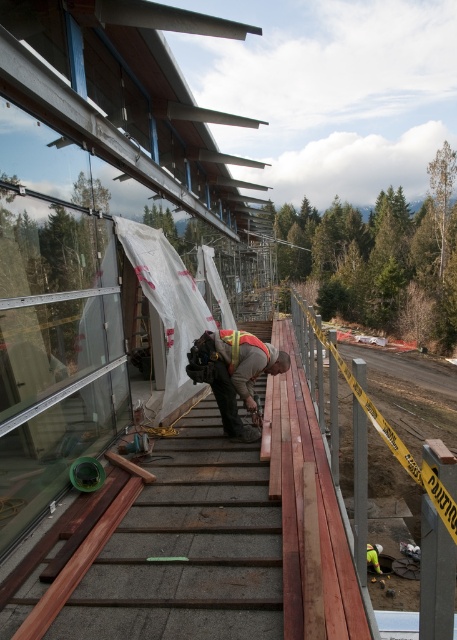
Question: Which point is closer to the camera?

Choices:
 (A) reflective orange safety vest at center
 (B) reflective safety vest at center
 (C) smooth wood stairs at center

Answer: (C)

Question: Which of the following is the closest to the observer?

Choices:
 (A) (x=259, y=340)
 (B) (x=271, y=353)

Answer: (A)

Question: Is reflective safety vest at center further to the viewer compared to reflective orange safety vest at center?

Choices:
 (A) yes
 (B) no

Answer: (B)

Question: Which object appears closest to the camera in this image?

Choices:
 (A) smooth wood stairs at center
 (B) reflective safety vest at center

Answer: (A)

Question: Is smooth wood stairs at center wider than reflective safety vest at center?

Choices:
 (A) no
 (B) yes

Answer: (B)

Question: Can you confirm if reflective safety vest at center is bigger than reflective orange safety vest at center?

Choices:
 (A) no
 (B) yes

Answer: (B)